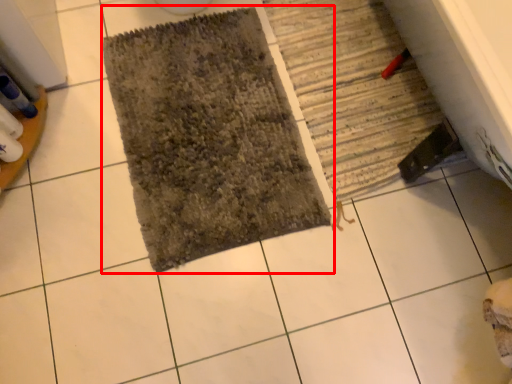
Question: From the image's perspective, where is bath mat (annotated by the red box) located in relation to bath mat in the image?

Choices:
 (A) below
 (B) above

Answer: (A)